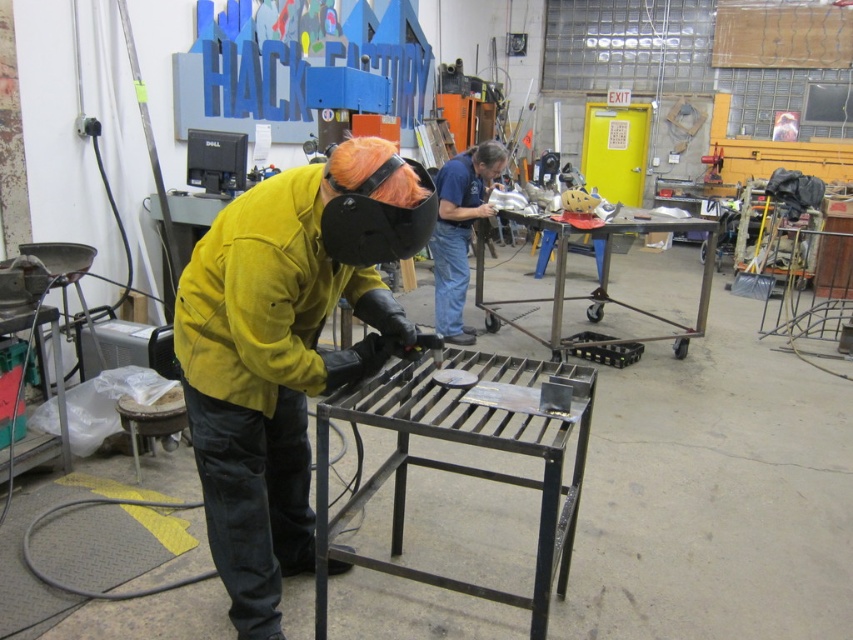
You are a safety inspector in the Hack Factory workshop. You notice two workers wearing a yellow leather jacket at center and a blue denim shirt at center. According to the safety protocol, workers must maintain a minimum distance of 2 meters between each other when operating welding equipment. Can you determine if the two workers are complying with this safety regulation?

The yellow leather jacket at center is positioned on the left side of blue denim shirt at center, but the distance between them is not specified in the description. Therefore, it is impossible to confirm if they are maintaining the required 2 meters distance.

You are organizing a workshop event and need to ensure that all participants have enough space to move around. Given that the yellow leather jacket at center and the blue denim shirt at center are both worn by people standing next to each other, which clothing item would require more horizontal space between them?

The yellow leather jacket at center requires more horizontal space because its width surpasses that of the blue denim shirt at center.

You are a safety inspector standing at the camera position. You need to check if the distance between you and the yellow leather jacket at center is within the safe inspection range of 1.5 meters. Is the distance within the safe range?

The distance between the yellow leather jacket at center and the camera is 1.56 meters, which exceeds the safe inspection range of 1.5 meters. Therefore, the distance is not within the safe range.